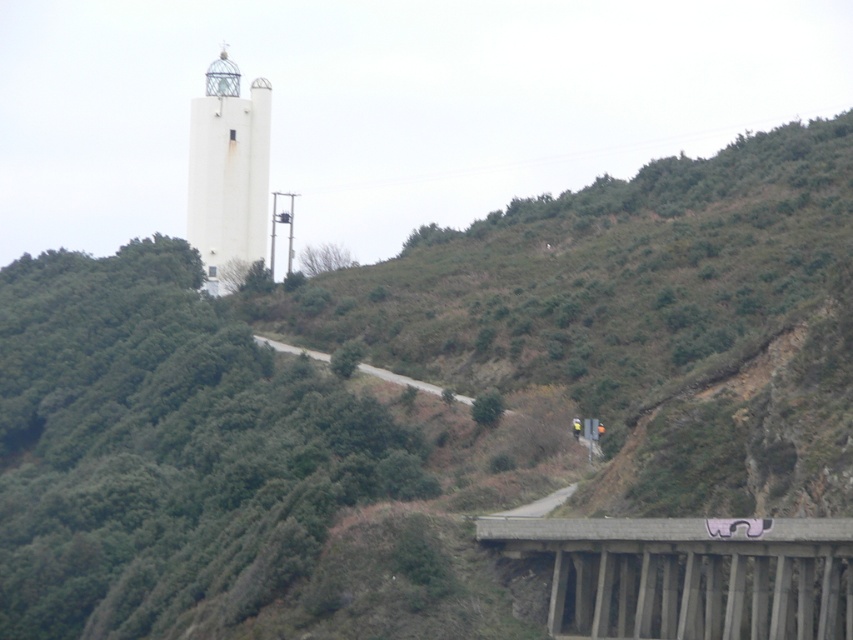
Who is more distant from viewer, [730,563] or [229,269]?

The point [229,269] is more distant.

Can you confirm if concrete at lower right is wider than white matte/lightweight bell tower at upper center?

No.

This screenshot has width=853, height=640. I want to click on concrete at lower right, so click(x=689, y=577).